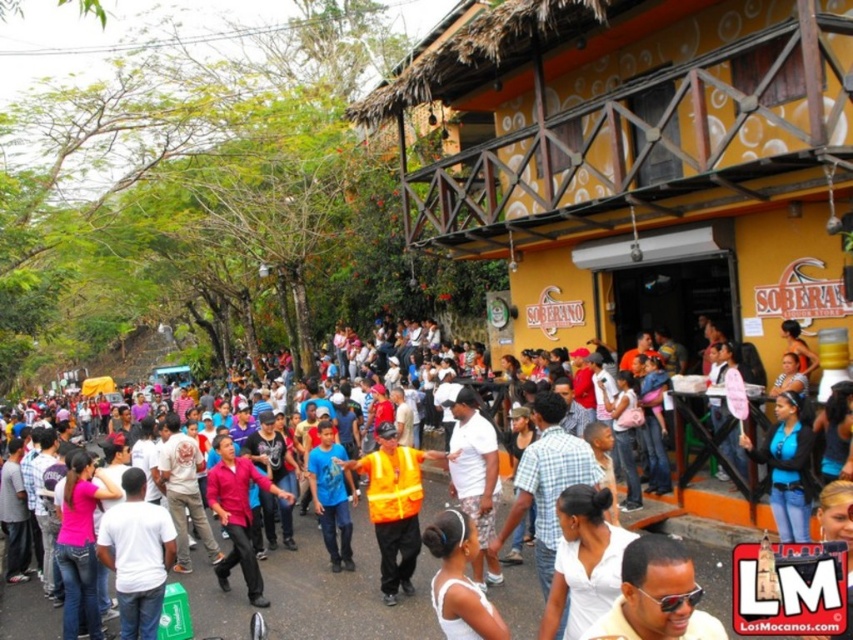
Looking at this image, you are a photographer standing at the camera position. You want to take a closeup shot of the blue denim jeans at lower right. Considering the distance, can you get a clear closeup without moving your position?

The blue denim jeans at lower right is 24.38 meters from the camera, so it is too far away to capture a clear closeup without moving closer or using a zoom lens.